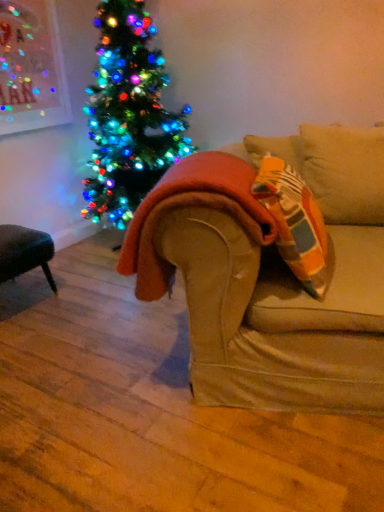
Question: Is point (322, 236) closer or farther from the camera than point (183, 202)?

Choices:
 (A) closer
 (B) farther

Answer: (B)

Question: From the image's perspective, relative to orange fuzzy blanket at center, is orange fabric pillow at right above or below?

Choices:
 (A) below
 (B) above

Answer: (B)

Question: From a real-world perspective, relative to orange fuzzy blanket at center, is orange fabric pillow at right vertically above or below?

Choices:
 (A) below
 (B) above

Answer: (B)

Question: Is orange fuzzy blanket at center taller or shorter than orange fabric pillow at right?

Choices:
 (A) short
 (B) tall

Answer: (A)

Question: Is point (134, 229) positioned closer to the camera than point (307, 194)?

Choices:
 (A) farther
 (B) closer

Answer: (B)

Question: Considering their positions, is orange fuzzy blanket at center located in front of or behind orange fabric pillow at right?

Choices:
 (A) front
 (B) behind

Answer: (B)

Question: Would you say orange fuzzy blanket at center is inside or outside orange fabric pillow at right?

Choices:
 (A) inside
 (B) outside

Answer: (B)